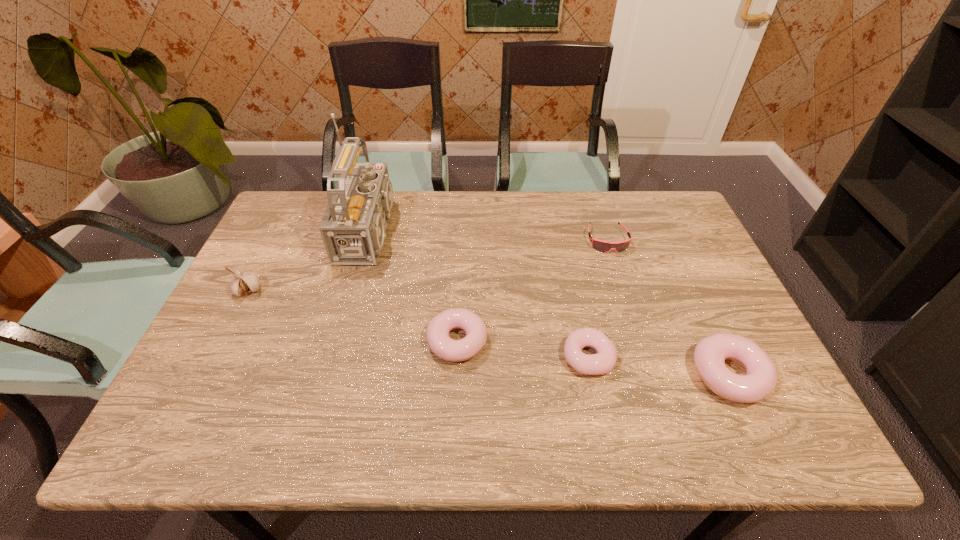
Please show where to add a doughnut on the left while keeping spacing even. Please provide its 2D coordinates. Your answer should be formatted as a tuple, i.e. [(x, y)], where the tuple contains the x and y coordinates of a point satisfying the conditions above.

[(333, 326)]